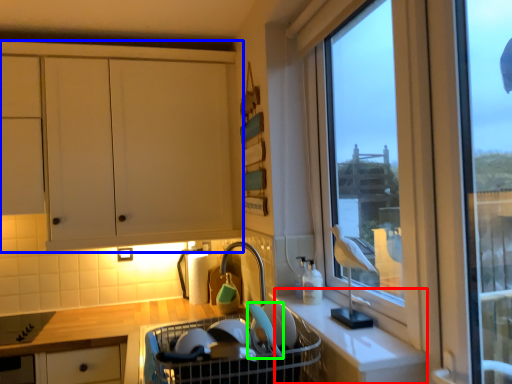
Question: Estimate the real-world distances between objects in this image. Which object is closer to counter (highlighted by a red box), cabinetry (highlighted by a blue box) or appliance (highlighted by a green box)?

Choices:
 (A) cabinetry
 (B) appliance

Answer: (B)